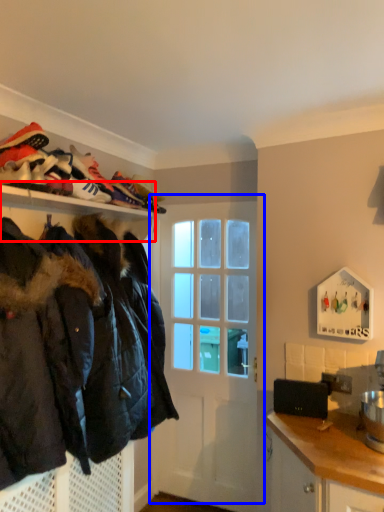
Question: Which object appears closest to the camera in this image, shelf (highlighted by a red box) or door (highlighted by a blue box)?

Choices:
 (A) shelf
 (B) door

Answer: (A)